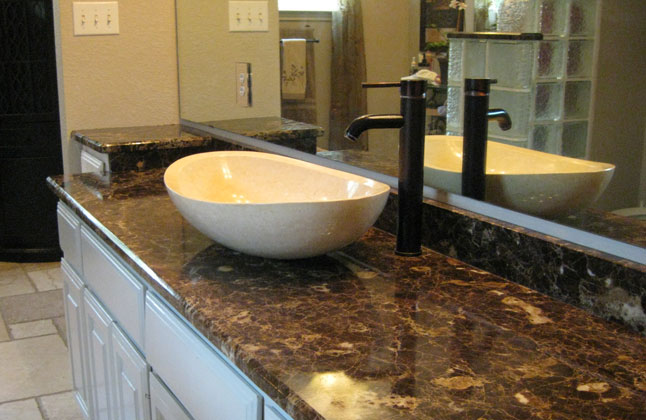
In order to click on shower curtain in this screenshot , I will do coord(351,63).